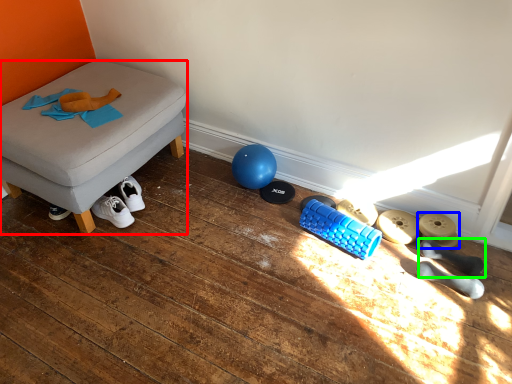
Question: Which object is positioned closest to furniture (highlighted by a red box)? Select from footwear (highlighted by a blue box) and footwear (highlighted by a green box).

Choices:
 (A) footwear
 (B) footwear

Answer: (A)